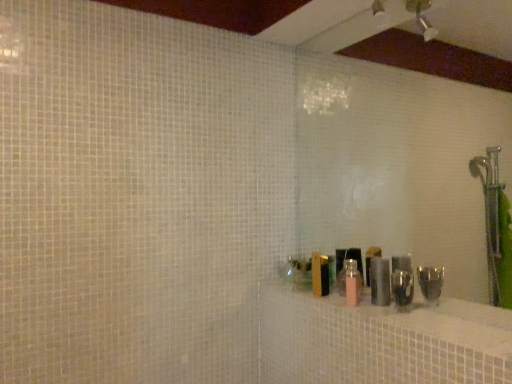
The width and height of the screenshot is (512, 384). What are the coordinates of `free space in front of metallic silver canister at right, which is the first toiletry from right to left` in the screenshot? It's located at pos(404,313).